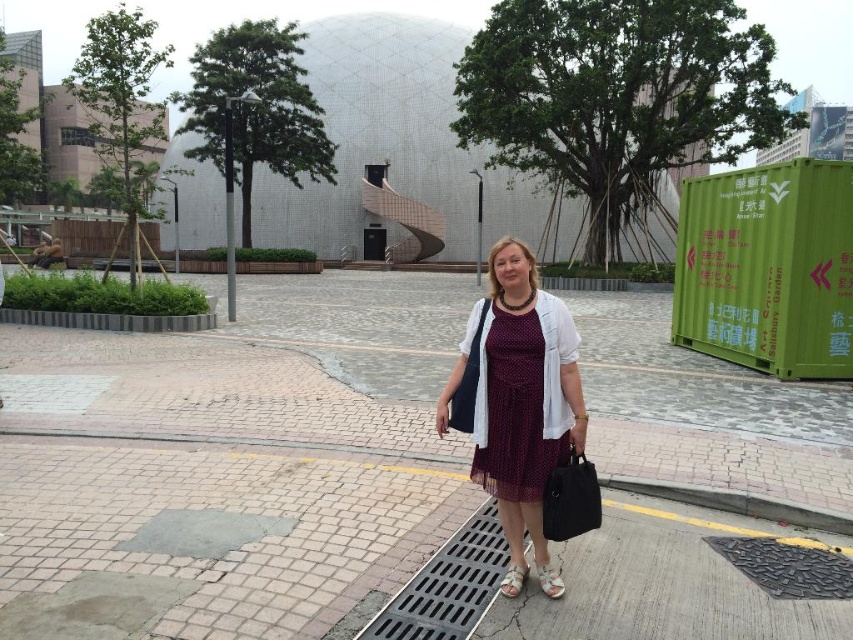
Question: Among these objects, which one is nearest to the camera?

Choices:
 (A) burgundy tulle dress at center
 (B) white textured sandal at lower center
 (C) burgundy dotted dress at center

Answer: (A)

Question: Which point is closer to the camera taking this photo?

Choices:
 (A) (495, 352)
 (B) (502, 595)
 (C) (561, 396)
 (D) (546, 576)

Answer: (C)

Question: Is burgundy tulle dress at center thinner than white textured sandal at lower center?

Choices:
 (A) yes
 (B) no

Answer: (B)

Question: Which point appears farthest from the camera in this image?

Choices:
 (A) (508, 394)
 (B) (480, 355)
 (C) (519, 576)

Answer: (C)

Question: Is burgundy tulle dress at center to the right of white fabric sandal at lower center from the viewer's perspective?

Choices:
 (A) yes
 (B) no

Answer: (A)

Question: Is white textured sandal at lower center to the right of white fabric sandal at lower center from the viewer's perspective?

Choices:
 (A) yes
 (B) no

Answer: (A)